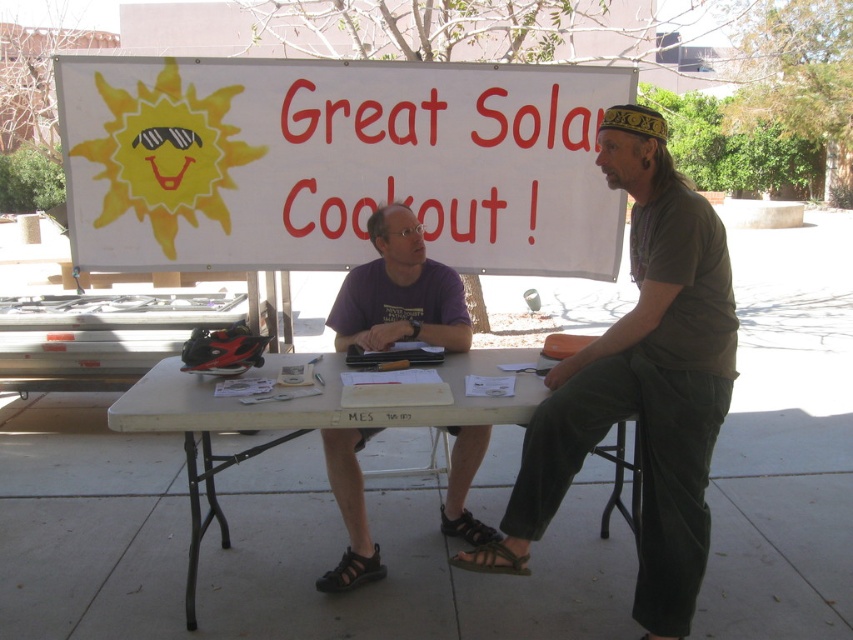
Question: Which point is farther to the camera?

Choices:
 (A) (326, 577)
 (B) (660, 627)
 (C) (535, 385)

Answer: (A)

Question: Does brown cotton shirt at center have a larger size compared to black leather sandal at lower center?

Choices:
 (A) yes
 (B) no

Answer: (A)

Question: Which of the following is the farthest from the observer?

Choices:
 (A) (407, 296)
 (B) (520, 573)
 (C) (668, 621)
 (D) (349, 556)

Answer: (A)

Question: Does brown cotton shirt at center come in front of black rubber sandal at lower center?

Choices:
 (A) no
 (B) yes

Answer: (B)

Question: Which point is farther to the camera?

Choices:
 (A) black leather sandal at lower center
 (B) white paperboard sign at upper center
 (C) purple cotton shirt at center
 (D) brown cotton shirt at center

Answer: (B)

Question: Can you confirm if white paperboard sign at upper center is thinner than purple cotton shirt at center?

Choices:
 (A) no
 (B) yes

Answer: (A)